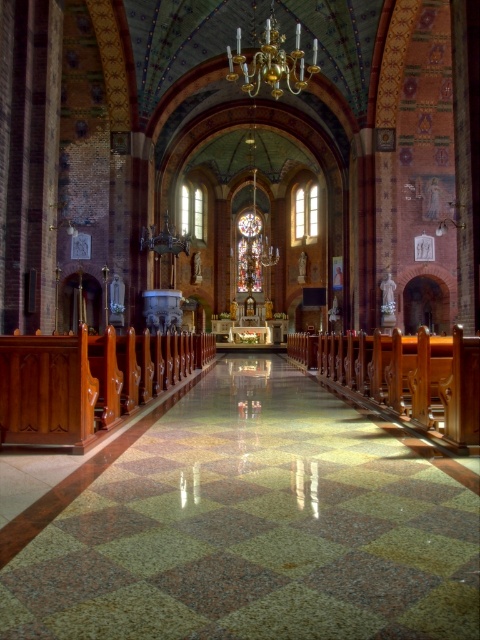
Question: Can you confirm if stained glass at center is positioned below clear glass window at center?

Choices:
 (A) yes
 (B) no

Answer: (A)

Question: Which point is farther from the camera taking this photo?

Choices:
 (A) (191, 205)
 (B) (252, 221)
 (C) (312, 225)
 (D) (397, 518)

Answer: (B)

Question: Among these points, which one is nearest to the camera?

Choices:
 (A) (196, 198)
 (B) (247, 273)
 (C) (296, 205)

Answer: (A)

Question: Estimate the real-world distances between objects in this image. Which object is closer to the stained glass at center?

Choices:
 (A) green polished stone aisle at center
 (B) clear glass window at center
 (C) clear stained glass window at center

Answer: (B)

Question: Can you confirm if green polished stone aisle at center is positioned to the left of stained glass at center?

Choices:
 (A) yes
 (B) no

Answer: (A)

Question: Is stained glass at center closer to camera compared to clear stained glass window at center?

Choices:
 (A) no
 (B) yes

Answer: (A)